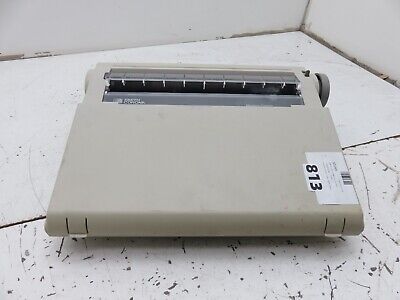
The height and width of the screenshot is (300, 400). In order to click on typewriter cover in this screenshot , I will do `click(184, 158)`.